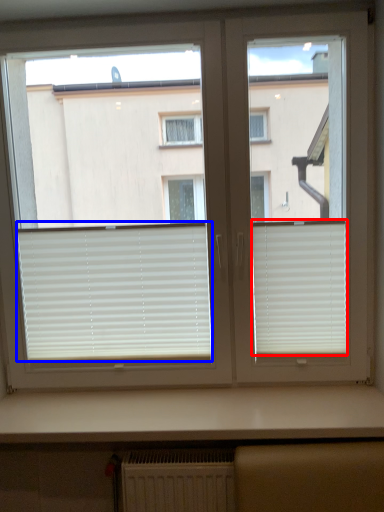
Question: Which object is closer to the camera taking this photo, window blind (highlighted by a red box) or window blind (highlighted by a blue box)?

Choices:
 (A) window blind
 (B) window blind

Answer: (A)